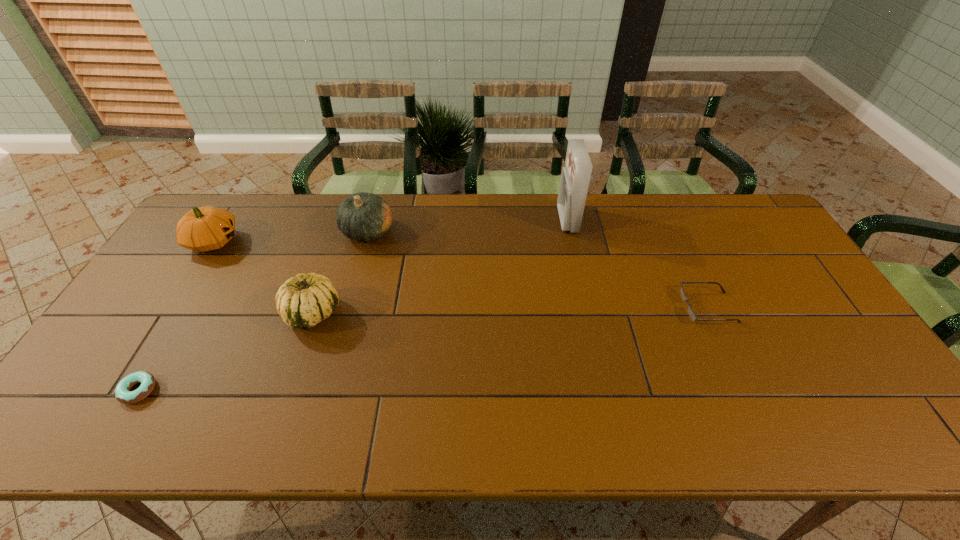
The height and width of the screenshot is (540, 960). I want to click on free region that satisfies the following two spatial constraints: 1. on the back side of the nearest gourd; 2. on the side of the leftmost gourd with the carved face, so click(337, 241).

Find the location of a particular element. The width and height of the screenshot is (960, 540). free space in the image that satisfies the following two spatial constraints: 1. on the side of the leftmost gourd with the carved face; 2. on the back side of the shortest object is located at coordinates (120, 390).

Find the location of a particular element. This screenshot has width=960, height=540. vacant area in the image that satisfies the following two spatial constraints: 1. on the side of the leftmost gourd with the carved face; 2. on the left side of the nearest gourd is located at coordinates (169, 313).

This screenshot has height=540, width=960. In order to click on free space that satisfies the following two spatial constraints: 1. on the side of the doughnut with the carved face; 2. on the left side of the leftmost gourd in this screenshot , I will do `click(120, 390)`.

Find the location of a particular element. This screenshot has width=960, height=540. vacant region that satisfies the following two spatial constraints: 1. on the side of the shortest object with the carved face; 2. on the left side of the leftmost gourd is located at coordinates (120, 390).

At what (x,y) coordinates should I click in order to perform the action: click on free space that satisfies the following two spatial constraints: 1. on the side of the nearest object with the carved face; 2. on the right side of the leftmost gourd. Please return your answer as a coordinate pair (x, y). Looking at the image, I should click on (120, 390).